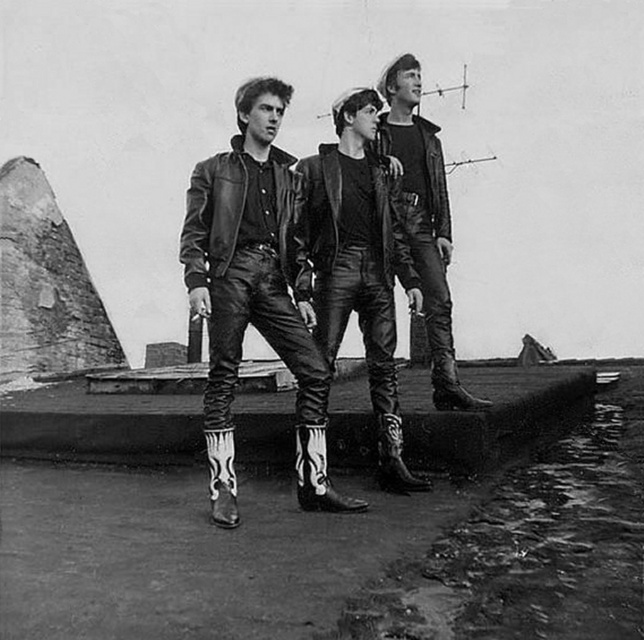
Does leather boots at center appear over leather jacket at center?

Incorrect, leather boots at center is not positioned above leather jacket at center.

Find the location of `leather boots at center`. leather boots at center is located at coordinates (254, 292).

Between leather pants at center and leather jacket at center, which one appears on the right side from the viewer's perspective?

From the viewer's perspective, leather jacket at center appears more on the right side.

Does leather pants at center appear on the right side of leather jacket at center?

In fact, leather pants at center is to the left of leather jacket at center.

At what (x,y) coordinates should I click in order to perform the action: click on leather pants at center. Please return your answer as a coordinate pair (x, y). The width and height of the screenshot is (644, 640). Looking at the image, I should click on (357, 262).

Does leather boots at center appear on the left side of leather pants at center?

Correct, you'll find leather boots at center to the left of leather pants at center.

Does leather boots at center have a lesser height compared to leather pants at center?

Yes.

Is point (258, 180) less distant than point (399, 419)?

Yes.

Locate an element on the screen. This screenshot has height=640, width=644. leather boots at center is located at coordinates (254, 292).